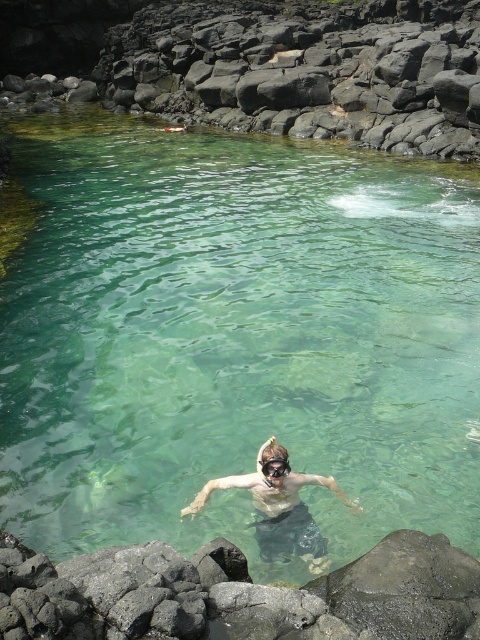
Is clear water at center bigger than dark gray rock at lower center?

Yes.

Locate an element on the screen. Image resolution: width=480 pixels, height=640 pixels. clear water at center is located at coordinates (231, 333).

Is point (188, 179) positioned behind point (327, 612)?

Yes, it is behind point (327, 612).

This screenshot has height=640, width=480. Find the location of `clear water at center`. clear water at center is located at coordinates (231, 333).

Can you confirm if clear water at center is smaller than black rock at upper center?

Yes, clear water at center is smaller than black rock at upper center.

Which is in front, point (469, 525) or point (475, 52)?

Point (469, 525)

Is point (214, 392) positioned before point (121, 100)?

Yes.

At what (x,y) coordinates should I click in order to perform the action: click on clear water at center. Please return your answer as a coordinate pair (x, y). The height and width of the screenshot is (640, 480). Looking at the image, I should click on (231, 333).

What do you see at coordinates (304, 68) in the screenshot?
I see `black rock at upper center` at bounding box center [304, 68].

Which is more to the right, black rock at upper center or dark gray rock at lower center?

From the viewer's perspective, black rock at upper center appears more on the right side.

Locate an element on the screen. The image size is (480, 640). black rock at upper center is located at coordinates (304, 68).